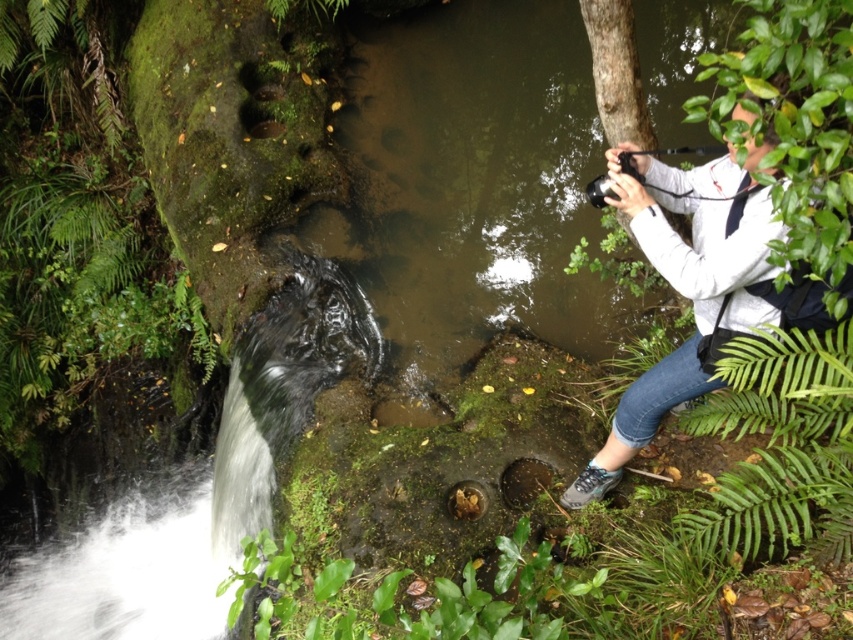
Does white fabric camera at upper right appear on the left side of green leafy fern at lower right?

Correct, you'll find white fabric camera at upper right to the left of green leafy fern at lower right.

Does white fabric camera at upper right have a smaller size compared to green leafy fern at lower right?

No.

This screenshot has width=853, height=640. In order to click on white fabric camera at upper right in this screenshot , I will do `click(697, 285)`.